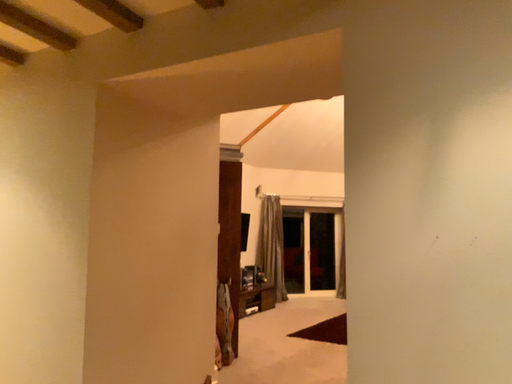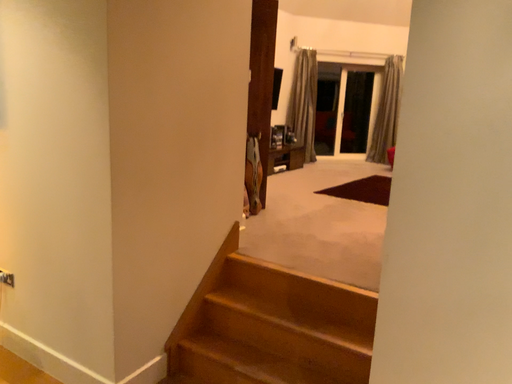
Question: How did the camera likely rotate when shooting the video?

Choices:
 (A) rotated upward
 (B) rotated downward

Answer: (B)